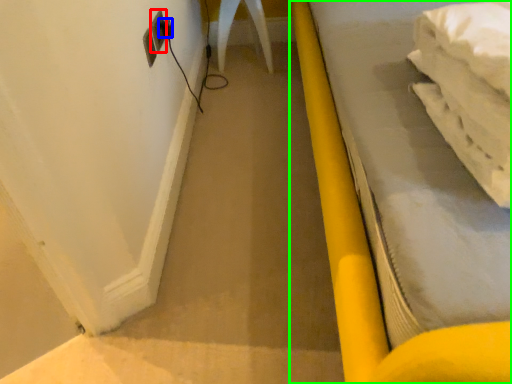
Question: Which object is positioned farthest from electric outlet (highlighted by a red box)? Select from plug (highlighted by a blue box) and furniture (highlighted by a green box).

Choices:
 (A) plug
 (B) furniture

Answer: (B)